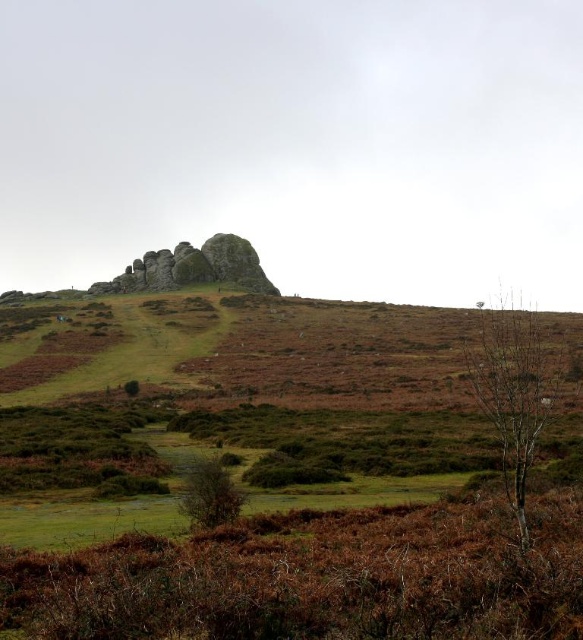
Question: Is rustic stone rock formation at center thinner than green matte tree at center?

Choices:
 (A) no
 (B) yes

Answer: (A)

Question: Which of these objects is positioned farthest from the rustic stone rock formation at center?

Choices:
 (A) green matte tree at center
 (B) bare wood at right

Answer: (A)

Question: Does rustic stone rock formation at center appear over green matte tree at center?

Choices:
 (A) yes
 (B) no

Answer: (A)

Question: Does rustic stone rock formation at center come behind green matte tree at center?

Choices:
 (A) no
 (B) yes

Answer: (B)

Question: Among these objects, which one is nearest to the camera?

Choices:
 (A) bare wood at right
 (B) rustic stone rock formation at center
 (C) green matte tree at center

Answer: (A)

Question: Which point is closer to the camera taking this photo?

Choices:
 (A) (128, 276)
 (B) (532, 452)

Answer: (B)